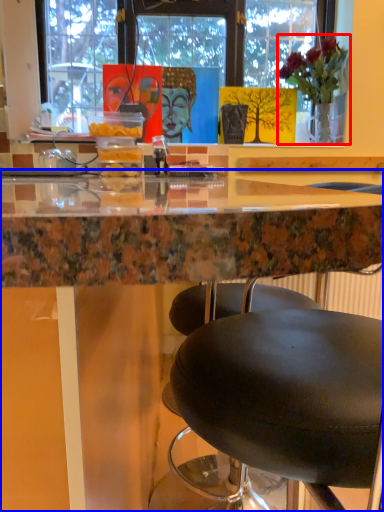
Question: Which of the following is the closest to the observer, houseplant (highlighted by a red box) or table (highlighted by a blue box)?

Choices:
 (A) houseplant
 (B) table

Answer: (B)